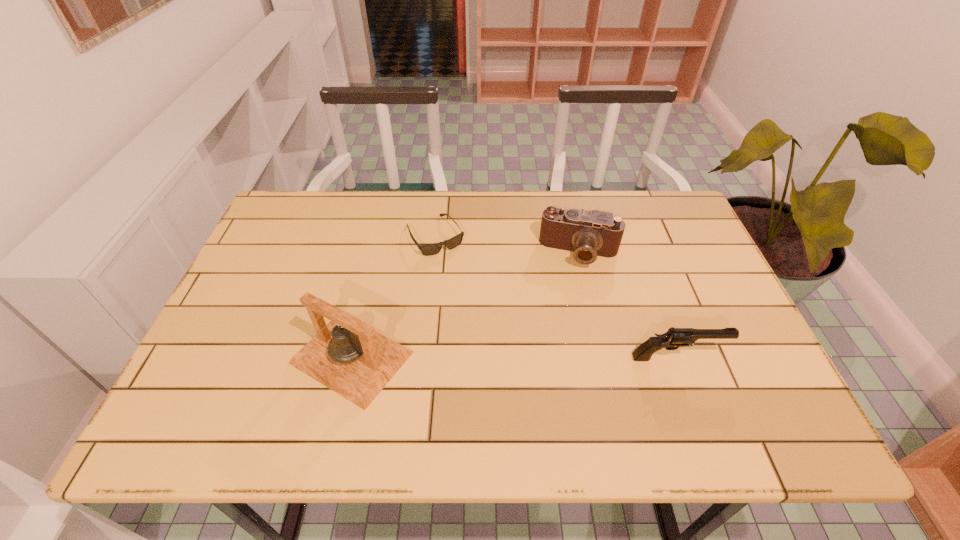
The image size is (960, 540). I want to click on bell, so click(x=347, y=355).

The image size is (960, 540). I want to click on gun, so click(x=674, y=338).

The image size is (960, 540). I want to click on sunglasses, so click(430, 249).

At what (x,y) coordinates should I click in order to perform the action: click on camera. Please return your answer as a coordinate pair (x, y). This screenshot has width=960, height=540. Looking at the image, I should click on (588, 234).

Find the location of a particular element. vacant space located 0.230m on the right of the bell is located at coordinates (515, 357).

The width and height of the screenshot is (960, 540). In order to click on free space located 0.350m on the front-facing side of the shortest object in this screenshot , I will do `click(508, 348)`.

The image size is (960, 540). Identify the location of free space located 0.090m on the front-facing side of the shortest object. (461, 276).

Find the location of a particular element. vacant space located 0.180m on the front-facing side of the shortest object is located at coordinates (475, 299).

This screenshot has width=960, height=540. I want to click on blank space located 0.380m on the front-facing side of the camera, so click(x=553, y=395).

The image size is (960, 540). I want to click on vacant region located on the front-facing side of the camera, so [x=555, y=379].